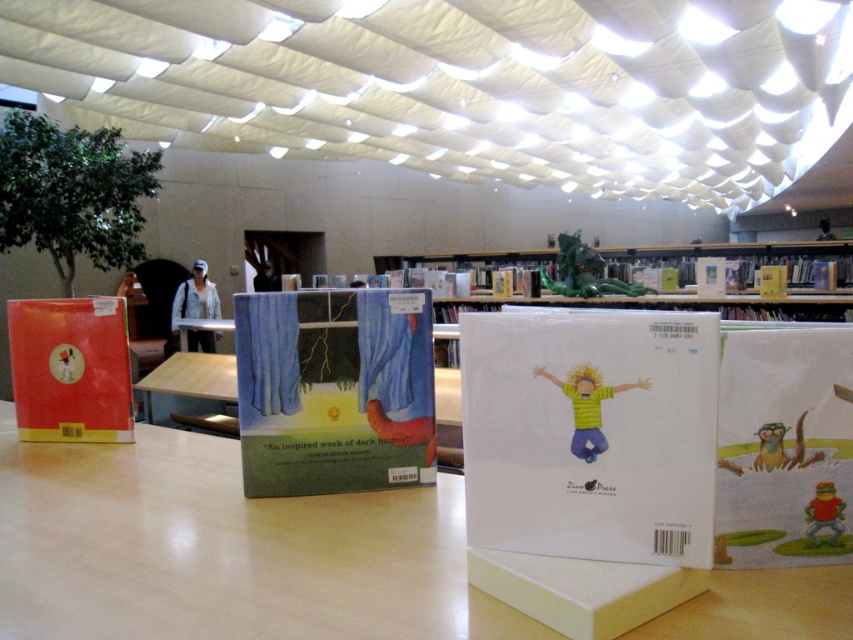
Question: Based on their relative distances, which object is nearer to the light brown wooden table at center?

Choices:
 (A) matte red book at left
 (B) matte paper book at center

Answer: (A)

Question: Where is light brown wooden table at center located in relation to hardcover book at upper center in the image?

Choices:
 (A) below
 (B) above

Answer: (A)

Question: Is blue fabric book at center to the right of hardcover book at upper center from the viewer's perspective?

Choices:
 (A) no
 (B) yes

Answer: (A)

Question: Which of these objects is positioned closest to the matte cardboard table at center?

Choices:
 (A) blue fabric book at center
 (B) matte red book at left
 (C) matte paper book at center
 (D) light brown wooden table at center

Answer: (B)

Question: Which point is closer to the camera?

Choices:
 (A) (194, 362)
 (B) (842, 557)

Answer: (B)

Question: Is light brown wooden table at center wider than blue fabric book at center?

Choices:
 (A) yes
 (B) no

Answer: (A)